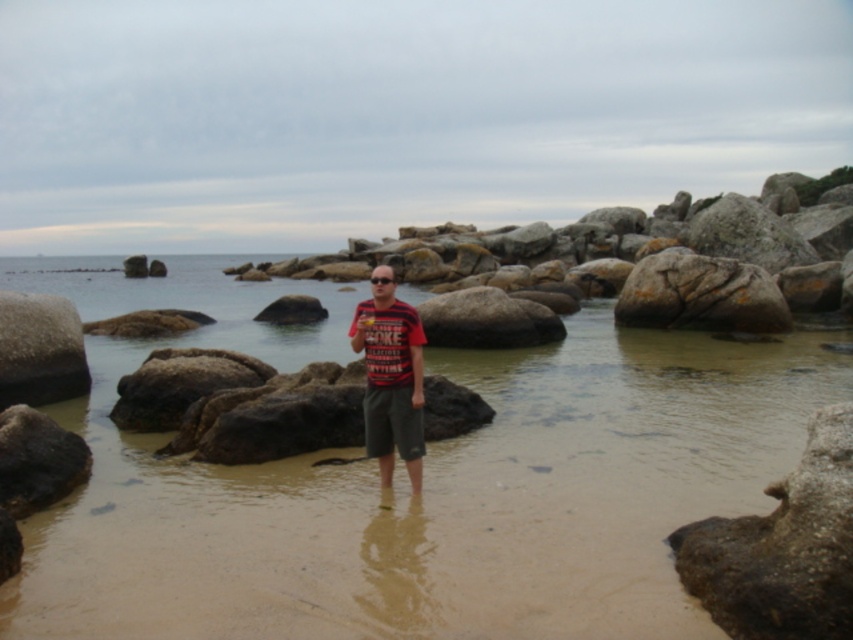
You are a photographer positioned at the center of the image. You want to capture a closeup shot of the smooth gray rock at lower right. Based on its coordinates, how far to the right and how far down from your current position should you move?

The smooth gray rock at lower right is located at coordinates point (x=782, y=548). Since you are at the center, you need to move 0.858 units to the right and 0.918 units downward to reach it.